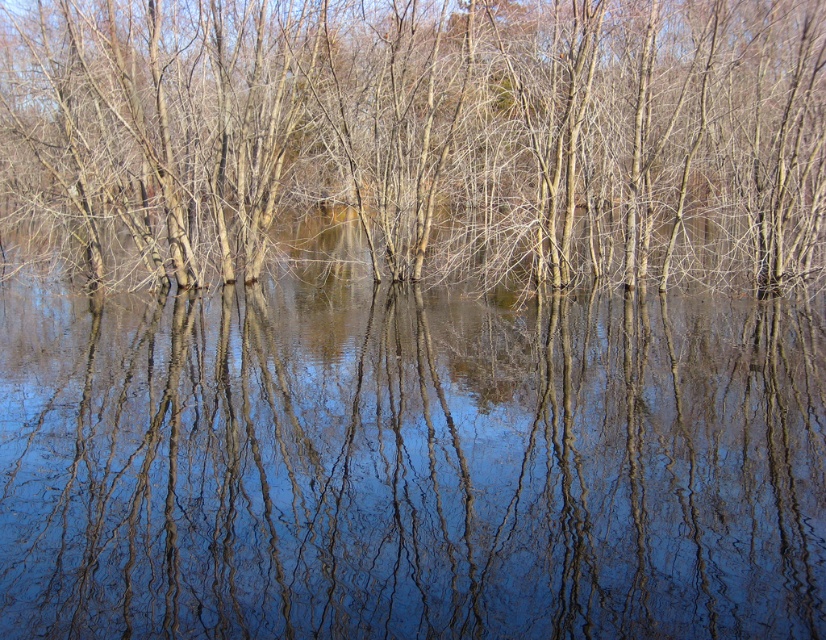
You are a bird flying over the flooded forest scene. You notice the transparent water at center and the brown matte tree at center. Which object is taller from your perspective?

The brown matte tree at center is taller than the transparent water at center.

You are standing at the edge of the flooded forest area shown in the image. There is a point marked at coordinates point (407,460) which is in the transparent water at center. If you want to walk to that point without getting your shoes wet, what should you do?

The point (407,460) is marked as transparent water at center, so to avoid getting your shoes wet, you should not walk directly to that point since it is in the water. Instead, you might need to find a path around the flooded area or wait for the water level to recede.